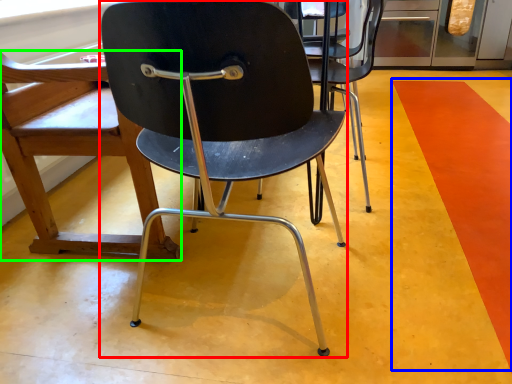
Question: Which object is the farthest from chair (highlighted by a red box)? Choose among these: strip (highlighted by a blue box) or chair (highlighted by a green box).

Choices:
 (A) strip
 (B) chair

Answer: (A)